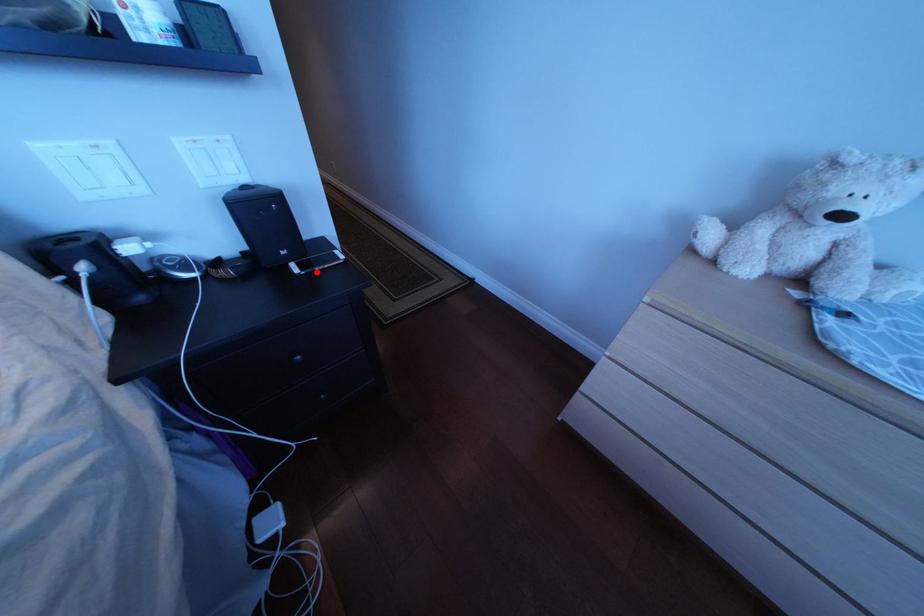
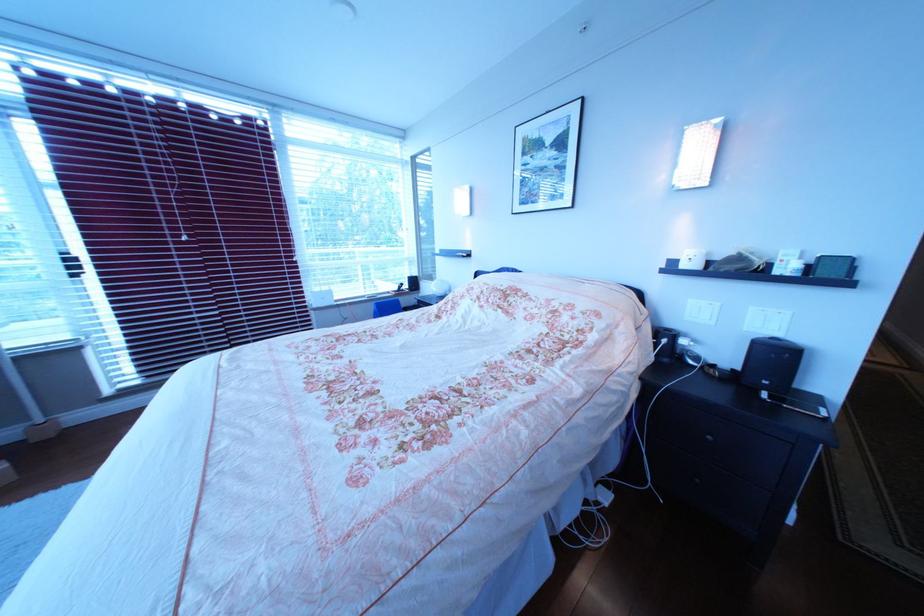
Locate, in the second image, the point that corresponds to the highlighted location in the first image.

(785, 400)